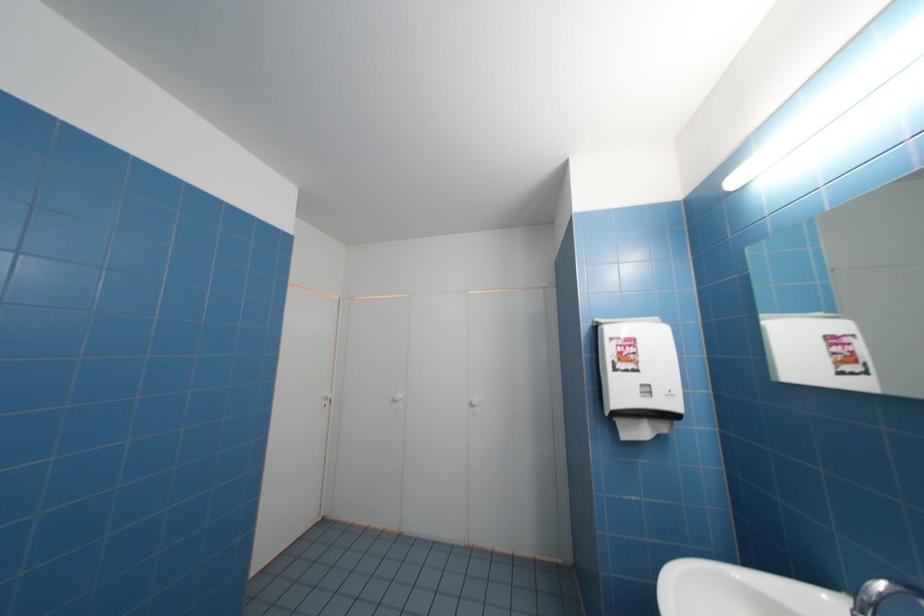
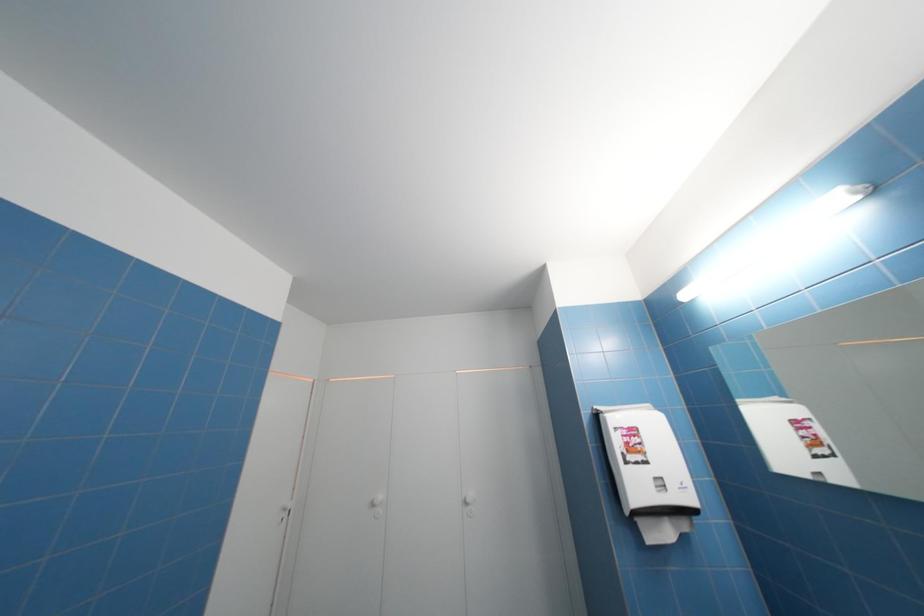
Question: How did the camera likely rotate?

Choices:
 (A) Left
 (B) Right
 (C) Up
 (D) Down

Answer: (C)